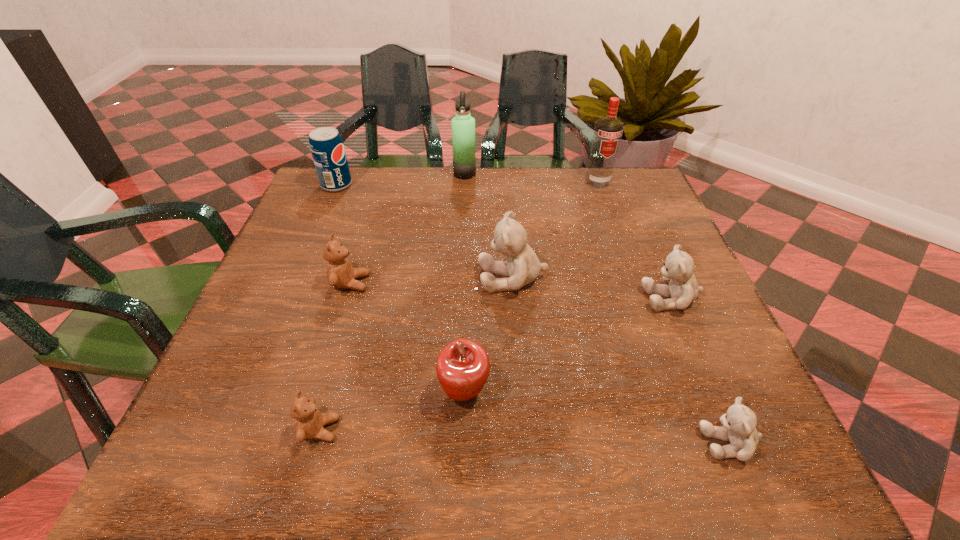
Identify the location of object identified as the eighth closest to the second biggest gray teddy bear. (327, 148).

Point out which teddy bear is positioned as the nearest to the nearest gray teddy bear. Please provide its 2D coordinates. Your answer should be formatted as a tuple, i.e. [(x, y)], where the tuple contains the x and y coordinates of a point satisfying the conditions above.

[(683, 289)]

Identify the location of the third closest teddy bear to the smaller brown teddy bear. The height and width of the screenshot is (540, 960). (x=738, y=427).

Identify which gray teddy bear is located as the nearest to the nearest gray teddy bear. Please provide its 2D coordinates. Your answer should be formatted as a tuple, i.e. [(x, y)], where the tuple contains the x and y coordinates of a point satisfying the conditions above.

[(683, 289)]

Where is `the second closest gray teddy bear relative to the nearer brown teddy bear`? This screenshot has height=540, width=960. the second closest gray teddy bear relative to the nearer brown teddy bear is located at coordinates (738, 427).

Identify the location of vacant space that satisfies the following two spatial constraints: 1. on the back side of the thermos bottle; 2. on the left side of the blue pop. (342, 174).